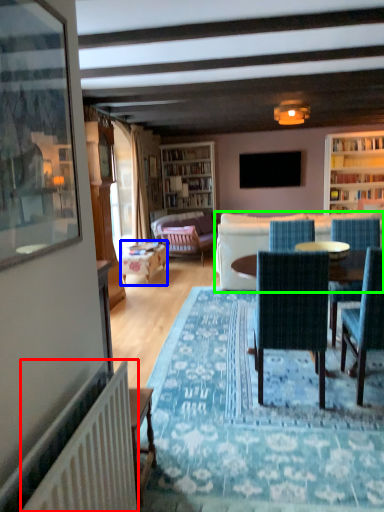
Question: Which is farther away from radiator (highlighted by a red box)? table (highlighted by a blue box) or studio couch (highlighted by a green box)?

Choices:
 (A) table
 (B) studio couch

Answer: (A)